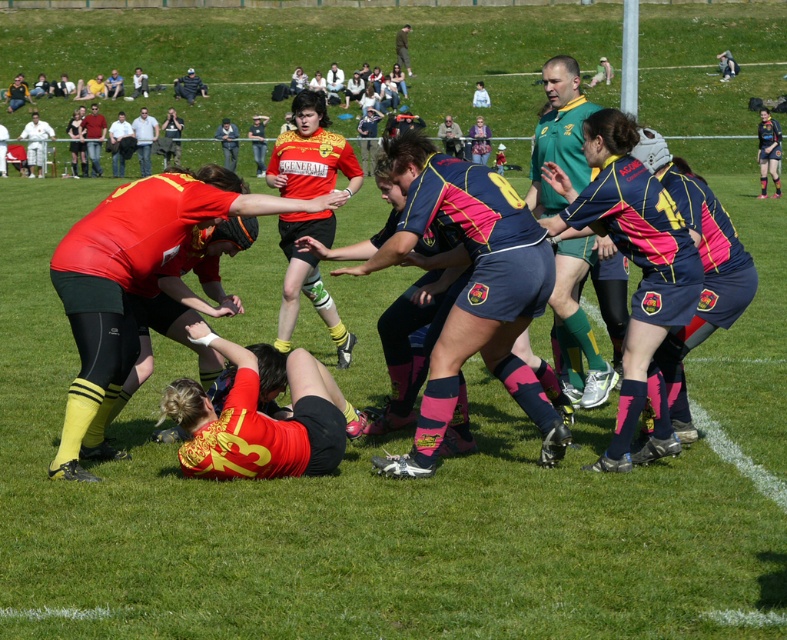
Consider the image. You are a photographer trying to capture the scrum action. You notice the matte yellow jersey at center and the matte black shorts at upper right. Which object should you zoom in on if you want to focus on the larger one?

The matte yellow jersey at center is larger in size than the matte black shorts at upper right, so you should zoom in on the matte yellow jersey at center.

Looking at this image, you are a player in the red jersey team. You want to pass the ball to your teammate wearing a green jersey at upper center located at point (558, 134). Can you directly pass the ball to that point without any obstruction?

The green jersey at upper center is located at point (558, 134). Since there are no other objects mentioned between you and the point, you can directly pass the ball to that point without obstruction.

You are a photographer standing at the edge of the rugby field. You want to take a photo that includes both the point at coordinates point (575, 385) and point (770, 138). Which point will appear larger in the photo?

Point (575, 385) is closer to the viewer than point (770, 138), so it will appear larger in the photo.